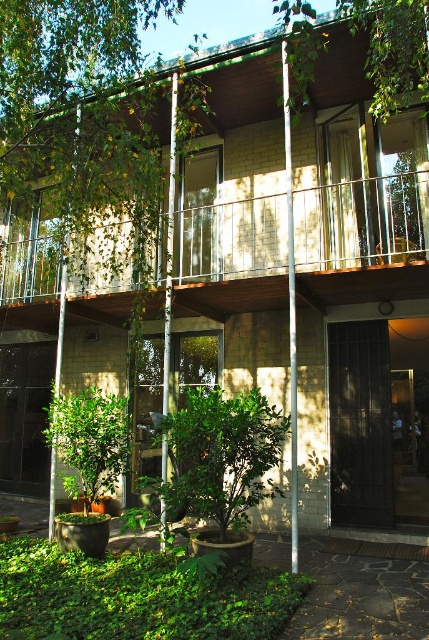
Question: Which object appears farthest from the camera in this image?

Choices:
 (A) green leafy tree at center
 (B) green leafy plant at lower center

Answer: (A)

Question: Considering the real-world distances, which object is farthest from the green wood balcony at upper center?

Choices:
 (A) green leafy tree at center
 (B) green leafy plant at lower center

Answer: (B)

Question: Which point appears farthest from the camera in this image?

Choices:
 (A) (156, 179)
 (B) (233, 72)
 (C) (141, 572)

Answer: (B)

Question: Can you confirm if green leafy tree at center is positioned below green leafy plant at lower center?

Choices:
 (A) no
 (B) yes

Answer: (A)

Question: Is green leafy tree at center to the left of green leafy plant at lower center from the viewer's perspective?

Choices:
 (A) yes
 (B) no

Answer: (A)

Question: Is green wood balcony at upper center bigger than green leafy tree at center?

Choices:
 (A) yes
 (B) no

Answer: (B)